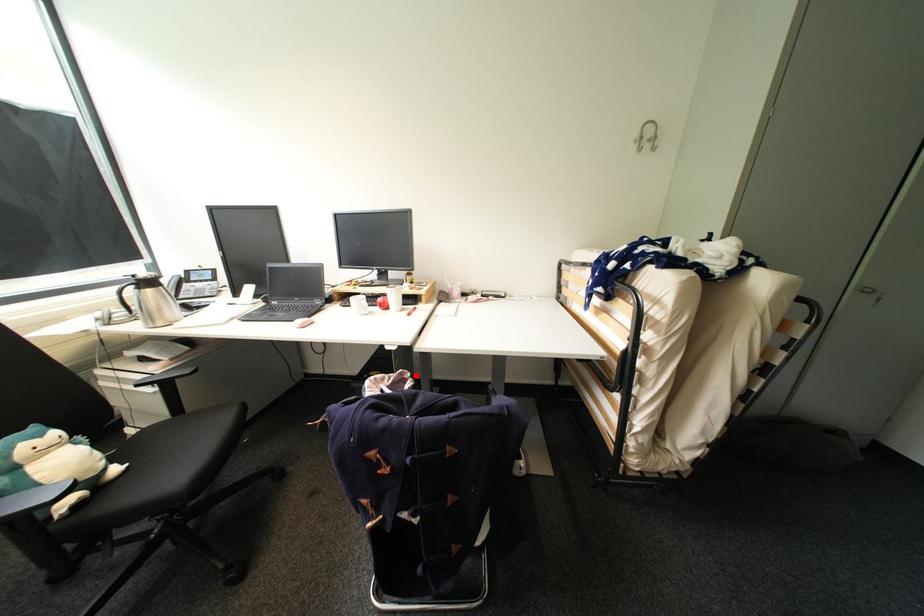
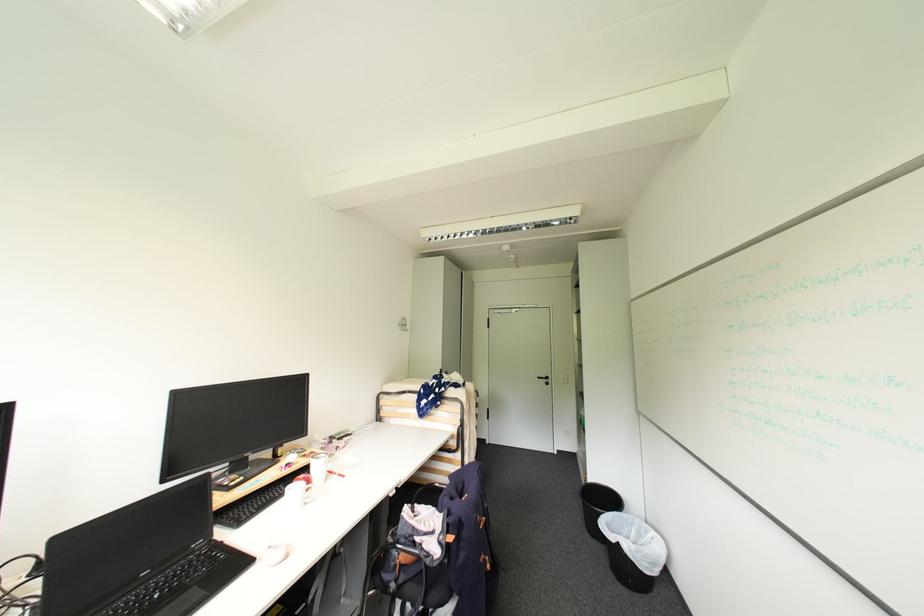
Question: I am providing you with two images of the same scene from different viewpoints. A red point is shown in image1. For the corresponding object point in image2, is it positioned nearer or farther from the camera?

Choices:
 (A) Nearer
 (B) Farther

Answer: (A)